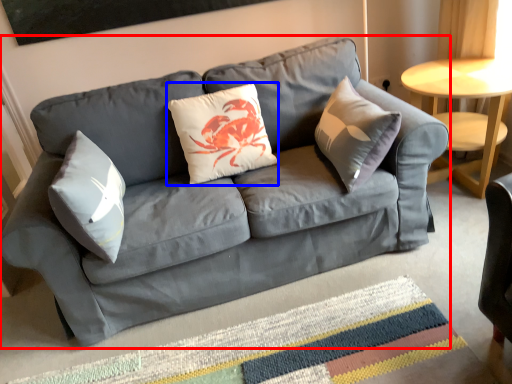
Question: Which of the following is the farthest to the observer, studio couch (highlighted by a red box) or pillow (highlighted by a blue box)?

Choices:
 (A) studio couch
 (B) pillow

Answer: (B)